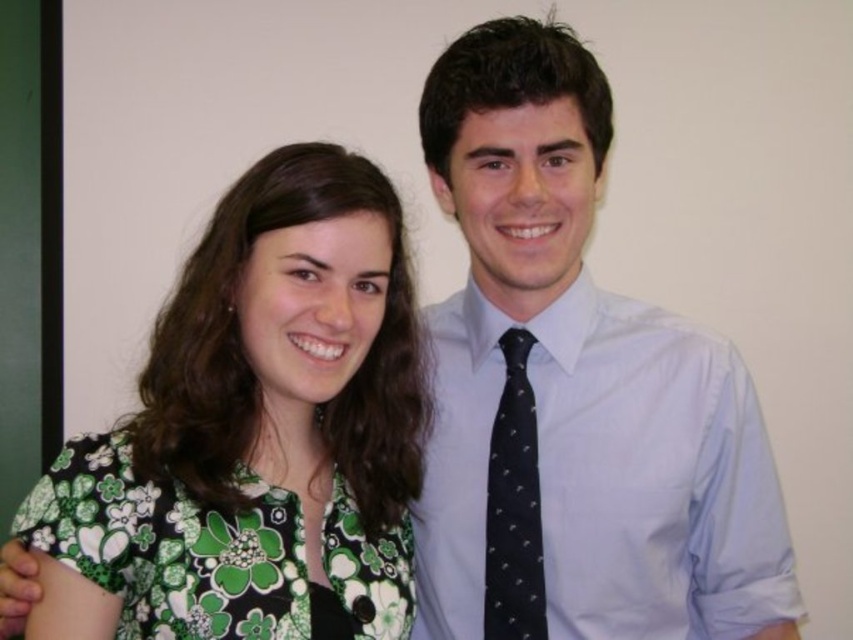
Is light blue shirt and tie at center wider than green floral shirt at left?

Correct, the width of light blue shirt and tie at center exceeds that of green floral shirt at left.

Is light blue shirt and tie at center shorter than green floral shirt at left?

In fact, light blue shirt and tie at center may be taller than green floral shirt at left.

Between point (647, 620) and point (398, 246), which one is positioned in front?

Point (398, 246) is in front.

Locate an element on the screen. light blue shirt and tie at center is located at coordinates (573, 392).

Which is more to the right, green floral shirt at left or black dotted tie at center?

black dotted tie at center is more to the right.

Is green floral shirt at left shorter than black dotted tie at center?

No.

Is point (231, 234) positioned in front of point (538, 570)?

Yes, point (231, 234) is closer to viewer.

This screenshot has height=640, width=853. In order to click on green floral shirt at left in this screenshot , I will do `click(277, 408)`.

Who is taller, light blue shirt and tie at center or black dotted tie at center?

With more height is light blue shirt and tie at center.

Who is higher up, light blue shirt and tie at center or black dotted tie at center?

light blue shirt and tie at center is higher up.

The height and width of the screenshot is (640, 853). I want to click on light blue shirt and tie at center, so click(x=573, y=392).